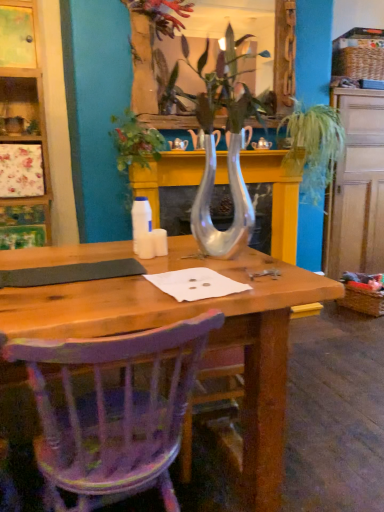
Question: Considering the relative sizes of wooden dresser at right and white glossy bottle at center in the image provided, is wooden dresser at right bigger than white glossy bottle at center?

Choices:
 (A) yes
 (B) no

Answer: (A)

Question: Does wooden dresser at right have a smaller size compared to white glossy bottle at center?

Choices:
 (A) no
 (B) yes

Answer: (A)

Question: Considering the relative sizes of wooden dresser at right and white glossy bottle at center in the image provided, is wooden dresser at right thinner than white glossy bottle at center?

Choices:
 (A) yes
 (B) no

Answer: (B)

Question: Is wooden dresser at right positioned beyond the bounds of white glossy bottle at center?

Choices:
 (A) no
 (B) yes

Answer: (B)

Question: Can you confirm if wooden dresser at right is shorter than white glossy bottle at center?

Choices:
 (A) yes
 (B) no

Answer: (B)

Question: Considering the relative sizes of wooden dresser at right and white glossy bottle at center in the image provided, is wooden dresser at right wider than white glossy bottle at center?

Choices:
 (A) yes
 (B) no

Answer: (A)

Question: Does purple painted wood chair at lower left appear on the left side of metallic silver flower at upper center?

Choices:
 (A) no
 (B) yes

Answer: (B)

Question: Is purple painted wood chair at lower left positioned behind metallic silver flower at upper center?

Choices:
 (A) no
 (B) yes

Answer: (A)

Question: Is purple painted wood chair at lower left at the right side of metallic silver flower at upper center?

Choices:
 (A) no
 (B) yes

Answer: (A)

Question: Is purple painted wood chair at lower left positioned with its back to metallic silver flower at upper center?

Choices:
 (A) yes
 (B) no

Answer: (B)

Question: Is metallic silver flower at upper center surrounded by purple painted wood chair at lower left?

Choices:
 (A) yes
 (B) no

Answer: (B)

Question: From a real-world perspective, is purple painted wood chair at lower left physically below metallic silver flower at upper center?

Choices:
 (A) no
 (B) yes

Answer: (B)

Question: Is metallic silver flower at upper center placed right next to purple painted wood chair at lower left?

Choices:
 (A) yes
 (B) no

Answer: (B)